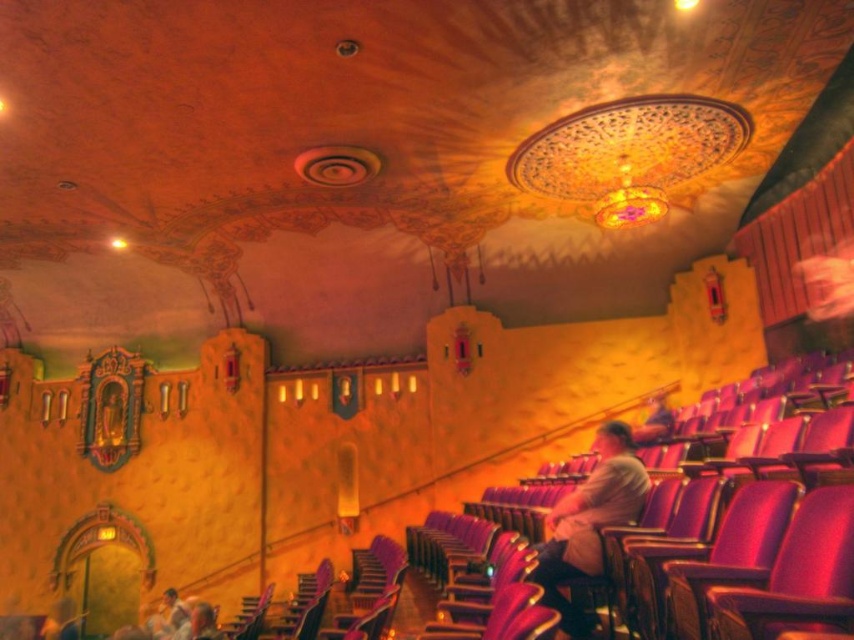
You are sitting in the theater and want to look at two points on the wall. The first point is at coordinate point (x=550, y=563) and the second is at point (x=189, y=627). Which point is closer to you?

Point (x=550, y=563) is in front of point (x=189, y=627), so it is closer to you.

You are an actor entering the theater and notice a light brown leather jacket at center and a matte gray hair at lower left. Which object is placed higher in the scene?

The light brown leather jacket at center is positioned over the matte gray hair at lower left, so it is higher in the scene.